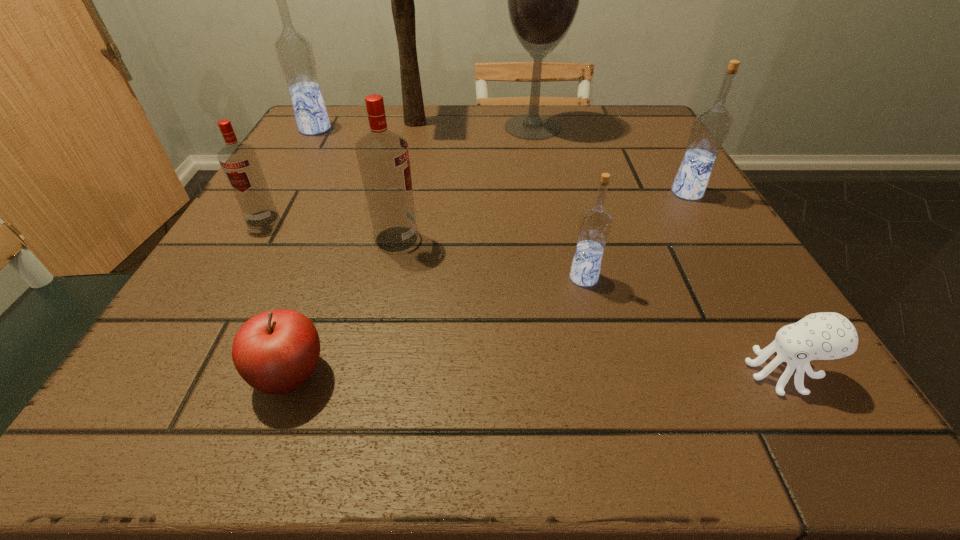
Find the location of a particular element. The width and height of the screenshot is (960, 540). vacant space at the far left corner of the desktop is located at coordinates (360, 124).

Where is `free space between the right red vodka and the left red vodka`? Image resolution: width=960 pixels, height=540 pixels. free space between the right red vodka and the left red vodka is located at coordinates (329, 228).

You are a GUI agent. You are given a task and a screenshot of the screen. Output one action in this format:
    pyautogui.click(x=<x>, y=<y>)
    Task: Click on the free area in between the tallest vodka and the octopus
    
    Given the screenshot: What is the action you would take?
    pyautogui.click(x=549, y=251)

Locate an element on the screen. This screenshot has height=540, width=960. free space that is in between the farthest blue vodka and the bigger red vodka is located at coordinates (356, 184).

Where is `free spot between the third tallest object and the nearest vodka`? The image size is (960, 540). free spot between the third tallest object and the nearest vodka is located at coordinates (449, 203).

This screenshot has height=540, width=960. I want to click on empty space that is in between the sixth nearest object and the red alcohol, so click(610, 160).

This screenshot has width=960, height=540. What are the coordinates of `unoccupied area between the smallest blue vodka and the bigger red vodka` in the screenshot? It's located at [x=491, y=258].

I want to click on unoccupied area between the smaller red vodka and the mallet, so click(x=339, y=170).

You are a GUI agent. You are given a task and a screenshot of the screen. Output one action in this format:
    pyautogui.click(x=<x>, y=<y>)
    Task: Click on the object that stands as the sixth closest to the second farthest vodka
    The width and height of the screenshot is (960, 540).
    Given the screenshot: What is the action you would take?
    pyautogui.click(x=275, y=352)

Identify which object is located as the second nearest to the bigger red vodka. Please provide its 2D coordinates. Your answer should be formatted as a tuple, i.e. [(x, y)], where the tuple contains the x and y coordinates of a point satisfying the conditions above.

[(275, 352)]